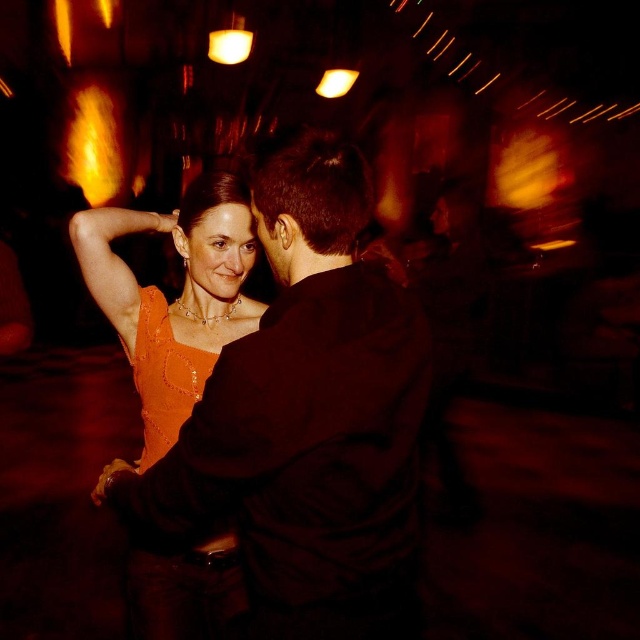
You are a photographer at the party and want to capture a photo of the matte black shirt at center and orange sequined dress at center. Since the lighting is dim, you need to ensure both subjects are well lit. Which subject should you adjust the camera focus on first to ensure proper exposure, considering their positions?

The matte black shirt at center should be focused on first because it is positioned on the right side of the orange sequined dress at center, and in dim lighting, darker clothing may require more exposure adjustments to capture details.

You are a photographer at the event and want to capture a photo of both the matte black shirt at center and the orange sequined dress at center in the same frame. Which object should you focus on first to ensure both are in focus?

The matte black shirt at center is taller than the orange sequined dress at center, so you should focus on the matte black shirt at center first to ensure both are in focus.

You are a photographer at the dance event and need to capture a clear photo of both the orange sequined dress at center and the shiny orange fabric dress at center. Considering the camera focus range is 6 inches, will both dresses be in focus?

The orange sequined dress at center is 6.46 inches away from the shiny orange fabric dress at center. Since the distance between them exceeds the camera focus range of 6 inches, both dresses may not be in focus simultaneously.